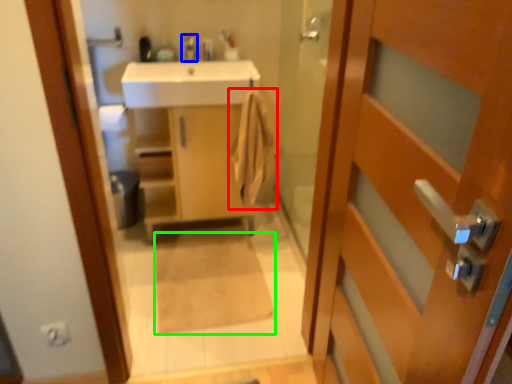
Question: Estimate the real-world distances between objects in this image. Which object is farther from bath towel (highlighted by a red box), tap (highlighted by a blue box) or bath mat (highlighted by a green box)?

Choices:
 (A) tap
 (B) bath mat

Answer: (A)